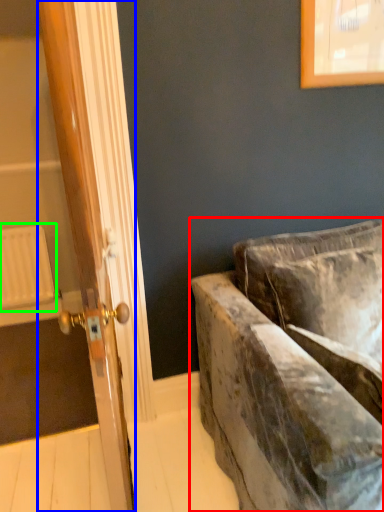
Question: Considering the real-world distances, which object is farthest from studio couch (highlighted by a red box)? door (highlighted by a blue box) or radiator (highlighted by a green box)?

Choices:
 (A) door
 (B) radiator

Answer: (B)